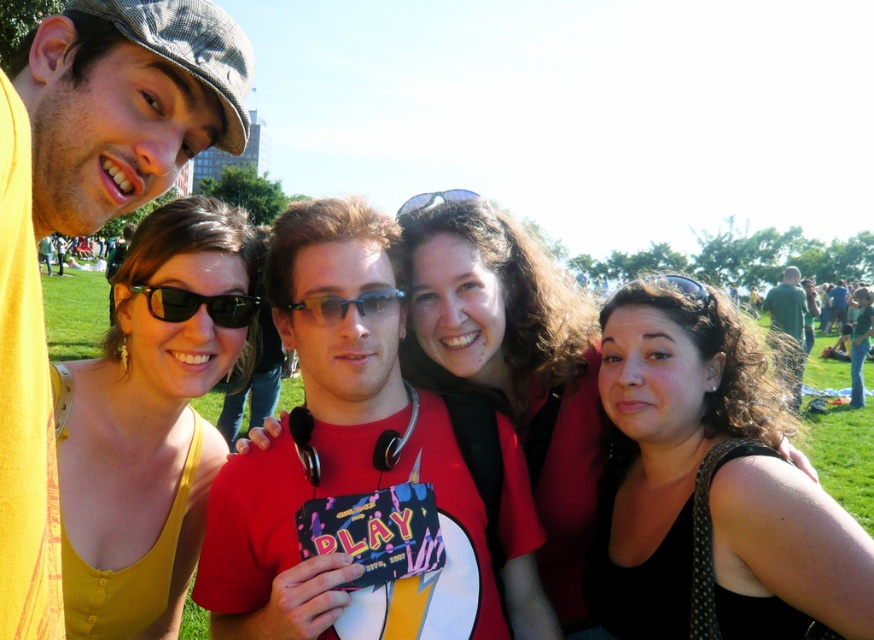
Question: Is yellow reflective plastic goggles at center below black rubber goggles at center?

Choices:
 (A) no
 (B) yes

Answer: (B)

Question: Which of these objects is positioned closest to the green matte shirt at right?

Choices:
 (A) black plastic sunglasses at center
 (B) yellow reflective plastic goggles at center
 (C) matte black backpack at upper right
 (D) matte plastic wallet at center

Answer: (D)

Question: Which point is farther to the camera?

Choices:
 (A) black rubber goggles at center
 (B) matte plastic wallet at center
 (C) yellow fabric tank top at left

Answer: (C)

Question: Does black fabric at center appear on the right side of black rubber goggles at center?

Choices:
 (A) yes
 (B) no

Answer: (A)

Question: Estimate the real-world distances between objects in this image. Which object is closer to the blue plastic sunglasses at upper center?

Choices:
 (A) yellow reflective plastic goggles at center
 (B) matte plastic wallet at center
 (C) green matte shirt at right

Answer: (A)

Question: Is green matte shirt at right bigger than black rubber goggles at center?

Choices:
 (A) no
 (B) yes

Answer: (B)